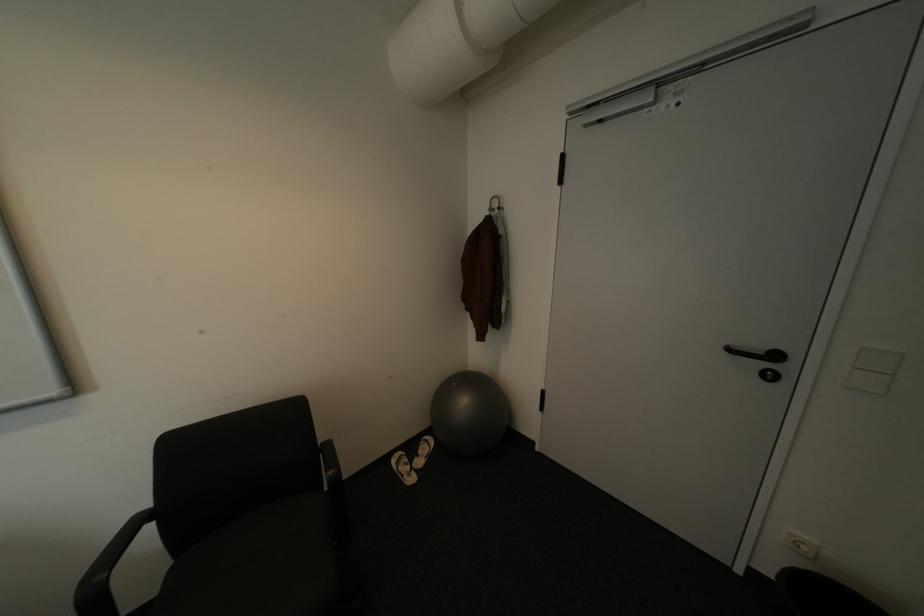
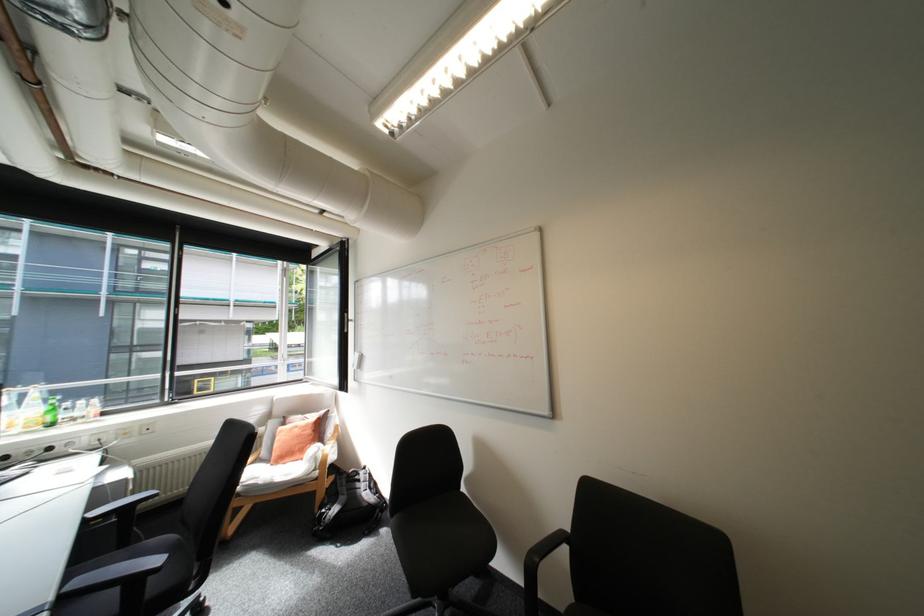
Question: The images are taken continuously from a first-person perspective. In which direction is your viewpoint rotating?

Choices:
 (A) Left
 (B) Right
 (C) Up
 (D) Down

Answer: (A)